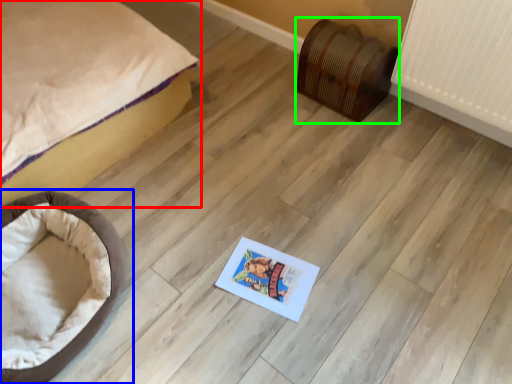
Question: Which is nearer to the bed (highlighted by a red box)? dog bed (highlighted by a blue box) or furniture (highlighted by a green box).

Choices:
 (A) dog bed
 (B) furniture

Answer: (A)